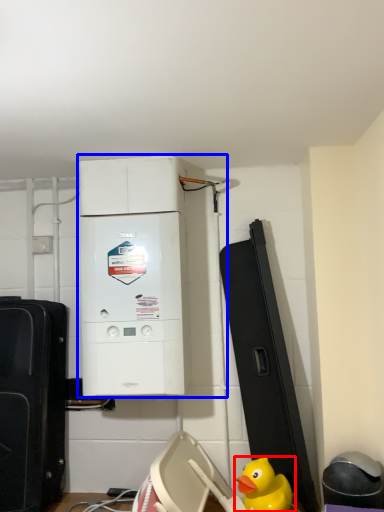
Question: Which object is closer to the camera taking this photo, duck (highlighted by a red box) or home appliance (highlighted by a blue box)?

Choices:
 (A) duck
 (B) home appliance

Answer: (A)